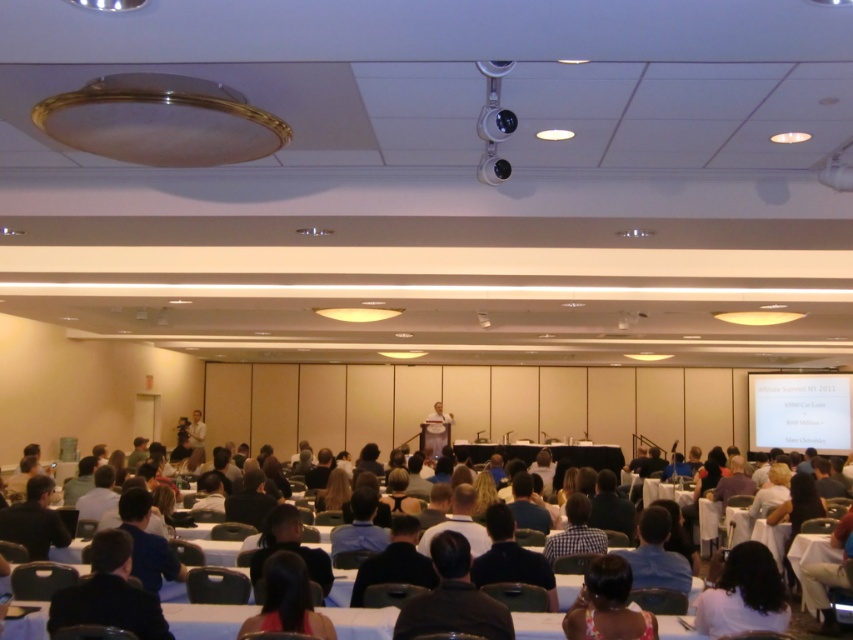
Question: Which point is closer to the camera taking this photo?

Choices:
 (A) (798, 394)
 (B) (514, 616)

Answer: (B)

Question: Does dark brown chairs at center come in front of white matte projection screen at center?

Choices:
 (A) yes
 (B) no

Answer: (A)

Question: Which point is farther to the camera?

Choices:
 (A) dark brown chairs at center
 (B) white matte projection screen at center

Answer: (B)

Question: Does dark brown chairs at center have a larger size compared to white matte projection screen at center?

Choices:
 (A) yes
 (B) no

Answer: (B)

Question: Where is dark brown chairs at center located in relation to white matte projection screen at center in the image?

Choices:
 (A) left
 (B) right

Answer: (A)